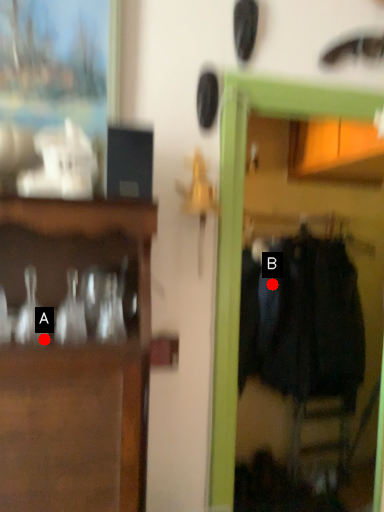
Question: Two points are circled on the image, labeled by A and B beside each circle. Which of the following is the farthest from the observer?

Choices:
 (A) A is further
 (B) B is further

Answer: (B)